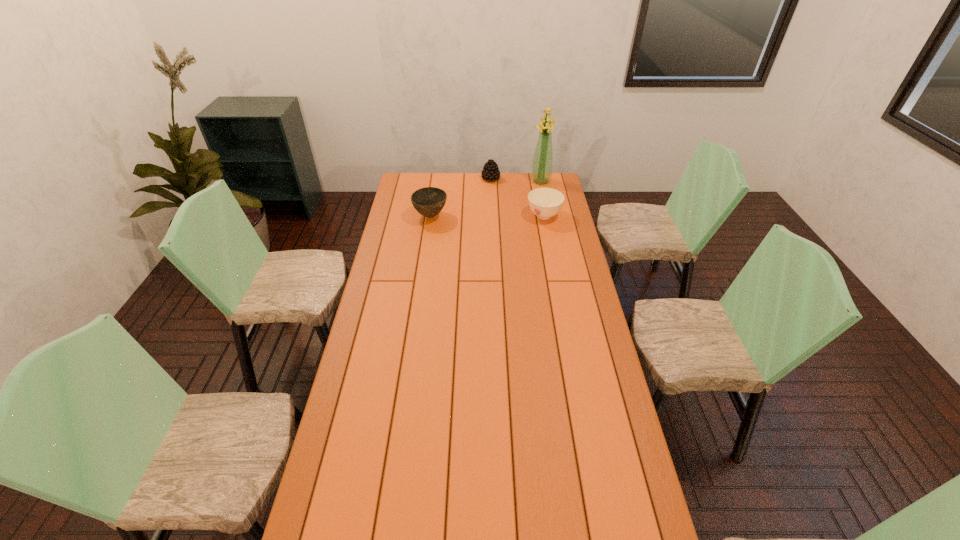
Locate an element on the screen. vacant space on the desktop that is between the bowl and the sugar bowl and is positioned on the front-facing side of the tallest object is located at coordinates (503, 216).

This screenshot has height=540, width=960. In order to click on vacant space on the desktop that is between the bowl and the sugar bowl and is positioned at the narrow end of the third object from right to left in this screenshot , I will do `click(473, 216)`.